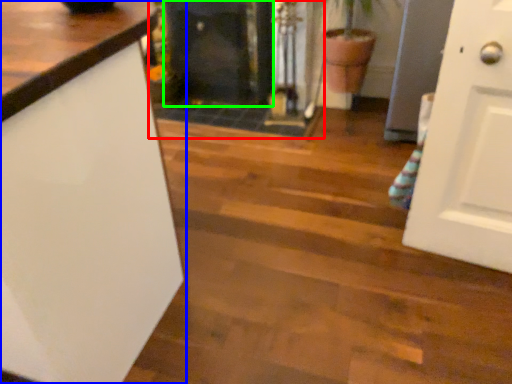
Question: Which object is the closest to the fireplace (highlighted by a red box)? Choose among these: countertop (highlighted by a blue box) or fireplace (highlighted by a green box).

Choices:
 (A) countertop
 (B) fireplace

Answer: (B)